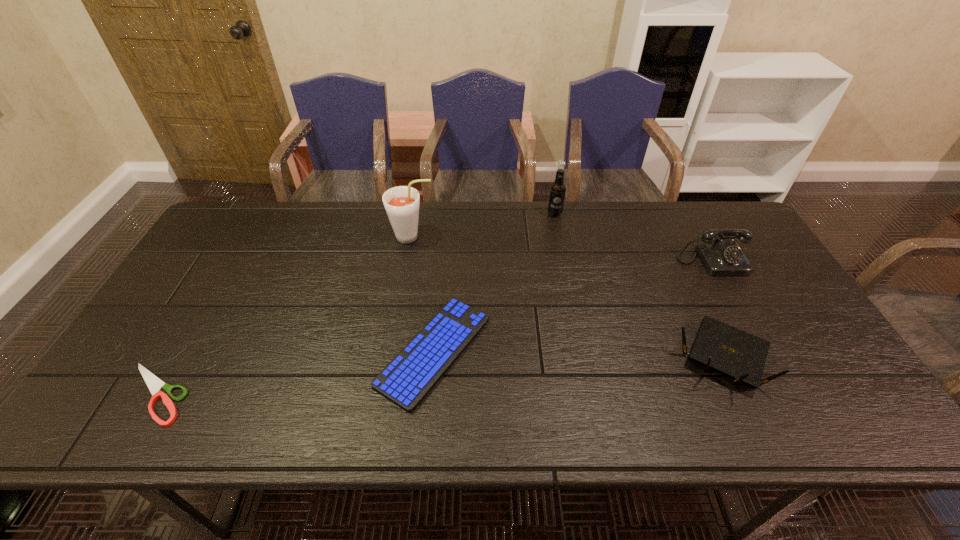
The height and width of the screenshot is (540, 960). I want to click on blank region between the telephone and the router, so click(717, 309).

Where is `free area in between the router and the computer keyboard`? Image resolution: width=960 pixels, height=540 pixels. free area in between the router and the computer keyboard is located at coordinates (578, 354).

Where is `free spot between the left root beer and the leftmost object`? free spot between the left root beer and the leftmost object is located at coordinates (283, 315).

Locate an element on the screen. This screenshot has width=960, height=540. empty space between the router and the fourth object from left to right is located at coordinates (638, 285).

Locate which object is the second closest to the scissors. Please provide its 2D coordinates. Your answer should be formatted as a tuple, i.e. [(x, y)], where the tuple contains the x and y coordinates of a point satisfying the conditions above.

[(401, 203)]

I want to click on object that is the fifth closest one to the right root beer, so click(x=154, y=384).

In order to click on vacant space that satisfies the following two spatial constraints: 1. on the label of the router; 2. on the left side of the farther root beer in this screenshot , I will do `click(583, 356)`.

This screenshot has height=540, width=960. I want to click on free region that satisfies the following two spatial constraints: 1. on the back side of the leftmost object; 2. on the left side of the router, so click(177, 356).

Find the location of a particular element. Image resolution: width=960 pixels, height=540 pixels. free space that satisfies the following two spatial constraints: 1. on the label of the fourth object from left to right; 2. on the drink side of the nearer root beer is located at coordinates (559, 237).